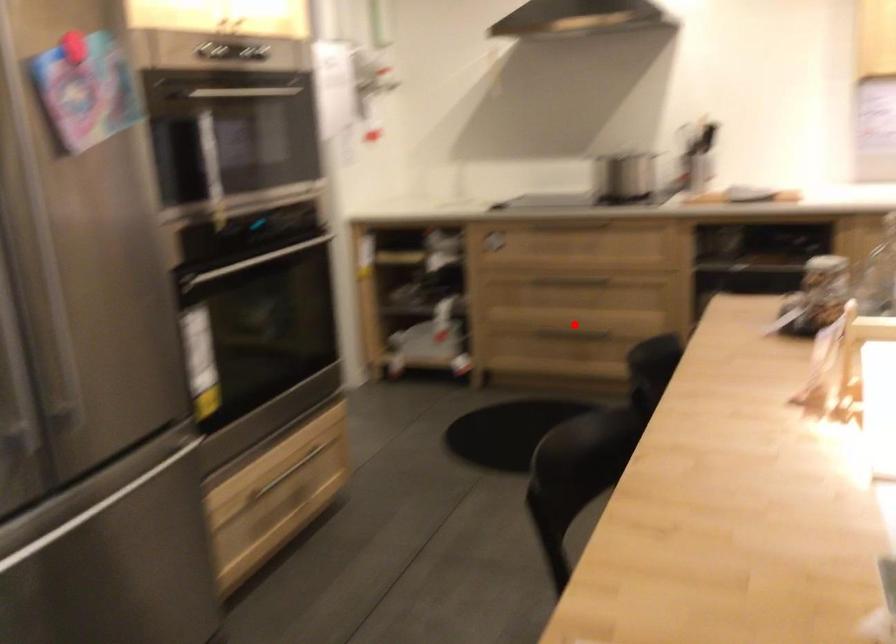
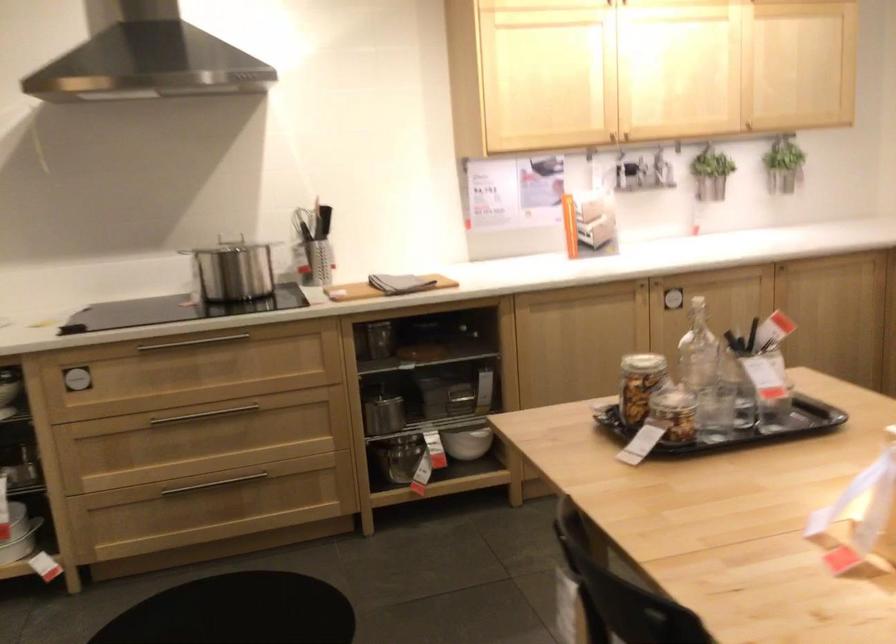
Where in the second image is the point corresponding to the highlighted location from the first image?

(213, 484)